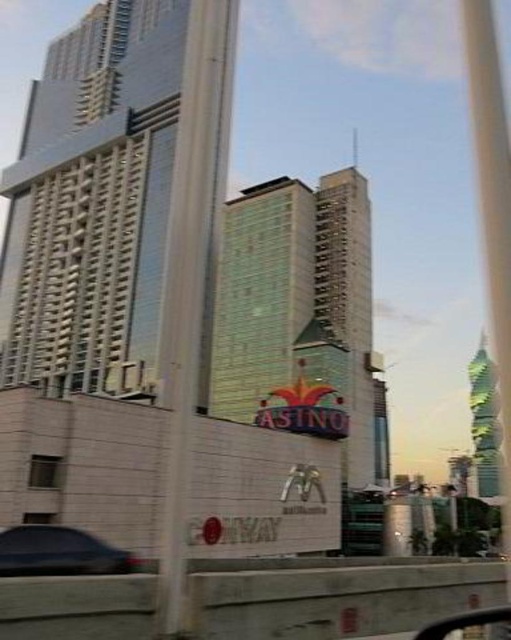
Question: Among these objects, which one is farthest from the camera?

Choices:
 (A) dark gray matte car at lower left
 (B) glassy reflective skyscraper at upper left
 (C) transparent glass car window at lower right
 (D) transparent glass window at lower left

Answer: (B)

Question: Which point appears closest to the camera in this image?

Choices:
 (A) (467, 621)
 (B) (119, 237)
 (C) (170, 243)
 (D) (38, 552)

Answer: (A)

Question: Does glassy reflective skyscraper at upper left have a larger size compared to dark gray matte car at lower left?

Choices:
 (A) no
 (B) yes

Answer: (B)

Question: Is metallic glass pole at center bigger than transparent glass window at lower left?

Choices:
 (A) yes
 (B) no

Answer: (A)

Question: Which of the following is the farthest from the observer?

Choices:
 (A) (35, 332)
 (B) (165, 504)
 (C) (39, 548)
 (D) (479, 449)

Answer: (D)

Question: Does glassy reflective skyscraper at upper left have a smaller size compared to metallic glass pole at center?

Choices:
 (A) no
 (B) yes

Answer: (A)